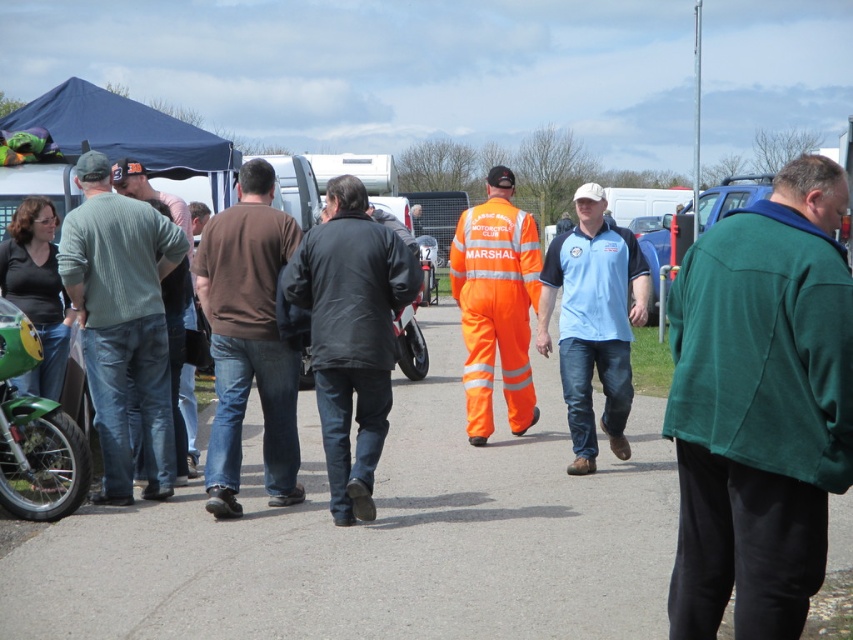
You are organizing a safety briefing and need to set up a marker between the dark green fleece jacket at right and the blue fabric canopy at upper left. Which object should the marker be closer to if it needs to be placed nearer to the narrower object?

The marker should be placed closer to the dark green fleece jacket at right because it has a lesser width compared to the blue fabric canopy at upper left.

You are standing at the position of the person in the orange marshal suit. You need to reach a checkpoint located at point (x=450, y=262). There is an obstacle at point (x=844, y=253). Can you safely walk around the obstacle to reach the checkpoint?

The obstacle at point (x=844, y=253) is closer to you than the checkpoint at point (x=450, y=262). Therefore, you can safely navigate around the obstacle to reach the checkpoint.